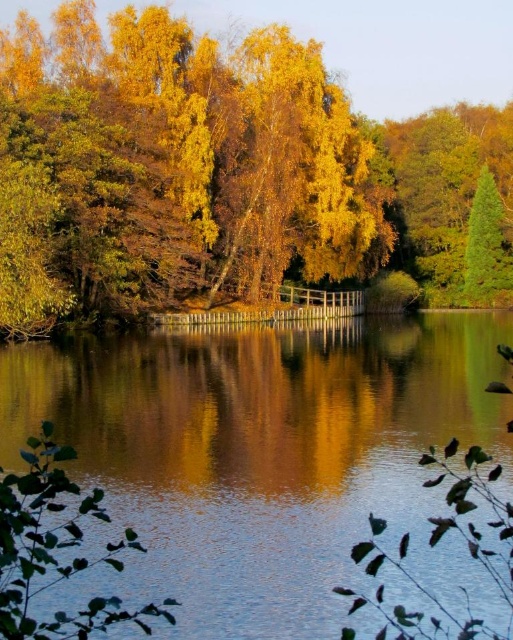
You are standing on the wooden railing in the midground and want to look towards the transparent water at center. Which direction should you turn to also see the yellow leafy tree at upper center in your view?

You should turn to your right because the yellow leafy tree at upper center is to the right of the transparent water at center.

You are standing on the wooden railing by the water and looking towards the yellow leafy tree at upper center. Can you see the transparent water at center through the tree?

The transparent water at center is behind the yellow leafy tree at upper center, so yes, you can see the transparent water at center through the tree.